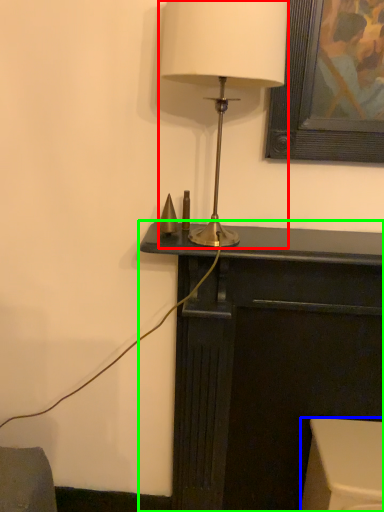
Question: Considering the real-world distances, which object is closest to lamp (highlighted by a red box)? furniture (highlighted by a blue box) or furniture (highlighted by a green box).

Choices:
 (A) furniture
 (B) furniture

Answer: (B)